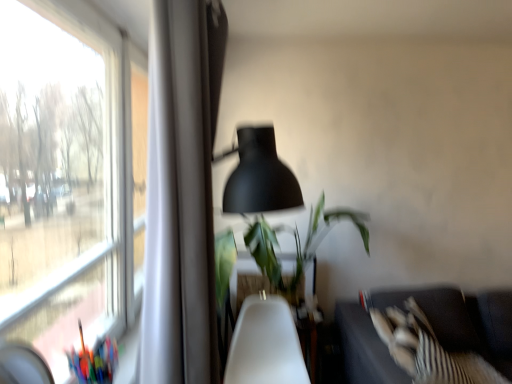
Question: Is green leafy plant at center at the back of dark gray fabric couch at lower right?

Choices:
 (A) yes
 (B) no

Answer: (B)

Question: Is dark gray fabric couch at lower right at the right side of green leafy plant at center?

Choices:
 (A) no
 (B) yes

Answer: (B)

Question: Is dark gray fabric couch at lower right taller than green leafy plant at center?

Choices:
 (A) no
 (B) yes

Answer: (B)

Question: From a real-world perspective, does dark gray fabric couch at lower right stand above green leafy plant at center?

Choices:
 (A) no
 (B) yes

Answer: (A)

Question: Is dark gray fabric couch at lower right beside green leafy plant at center?

Choices:
 (A) no
 (B) yes

Answer: (A)

Question: Is dark gray fabric couch at lower right positioned far away from green leafy plant at center?

Choices:
 (A) yes
 (B) no

Answer: (B)

Question: Is matte black lampshade at center thinner than green leafy plant at center?

Choices:
 (A) no
 (B) yes

Answer: (B)

Question: Is matte black lampshade at center to the right of green leafy plant at center from the viewer's perspective?

Choices:
 (A) yes
 (B) no

Answer: (B)

Question: Does matte black lampshade at center have a larger size compared to green leafy plant at center?

Choices:
 (A) no
 (B) yes

Answer: (A)

Question: Would you say matte black lampshade at center is outside green leafy plant at center?

Choices:
 (A) no
 (B) yes

Answer: (B)

Question: Is matte black lampshade at center not near green leafy plant at center?

Choices:
 (A) yes
 (B) no

Answer: (A)

Question: Can you confirm if matte black lampshade at center is shorter than green leafy plant at center?

Choices:
 (A) no
 (B) yes

Answer: (A)

Question: Is matte black lampshade at center aimed at white plastic swivel chair at center?

Choices:
 (A) no
 (B) yes

Answer: (A)